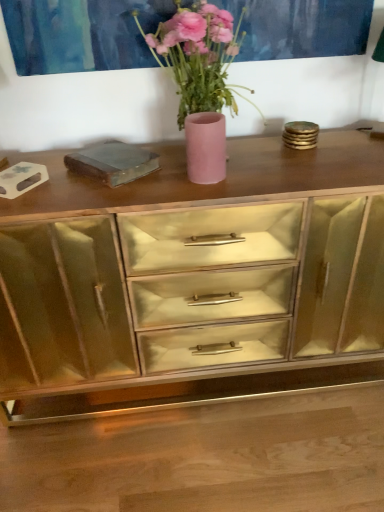
Question: Does pink matte vase at center appear on the left side of matte pink vase at center?

Choices:
 (A) yes
 (B) no

Answer: (B)

Question: Is pink matte vase at center facing away from matte pink vase at center?

Choices:
 (A) no
 (B) yes

Answer: (A)

Question: Is pink matte vase at center not near matte pink vase at center?

Choices:
 (A) yes
 (B) no

Answer: (B)

Question: Is pink matte vase at center touching matte pink vase at center?

Choices:
 (A) no
 (B) yes

Answer: (A)

Question: From a real-world perspective, is pink matte vase at center below matte pink vase at center?

Choices:
 (A) no
 (B) yes

Answer: (A)

Question: Is pink matte vase at center to the left or to the right of matte pink vase at center in the image?

Choices:
 (A) right
 (B) left

Answer: (A)

Question: Considering the positions of point (168, 32) and point (208, 135), is point (168, 32) closer or farther from the camera than point (208, 135)?

Choices:
 (A) farther
 (B) closer

Answer: (A)

Question: From the image's perspective, relative to matte pink vase at center, is pink matte vase at center above or below?

Choices:
 (A) above
 (B) below

Answer: (A)

Question: Is pink matte vase at center bigger or smaller than matte pink vase at center?

Choices:
 (A) big
 (B) small

Answer: (A)

Question: Based on their sizes in the image, would you say gold mirrored cabinet at center is bigger or smaller than pink matte vase at center?

Choices:
 (A) small
 (B) big

Answer: (B)

Question: Is gold mirrored cabinet at center inside or outside of pink matte vase at center?

Choices:
 (A) outside
 (B) inside

Answer: (A)

Question: Is gold mirrored cabinet at center wider or thinner than pink matte vase at center?

Choices:
 (A) thin
 (B) wide

Answer: (B)

Question: From the image's perspective, is gold mirrored cabinet at center located above or below pink matte vase at center?

Choices:
 (A) above
 (B) below

Answer: (B)

Question: Looking at their shapes, would you say matte pink vase at center is wider or thinner than pink matte vase at center?

Choices:
 (A) wide
 (B) thin

Answer: (B)

Question: Considering the positions of point (203, 128) and point (226, 53), is point (203, 128) closer or farther from the camera than point (226, 53)?

Choices:
 (A) farther
 (B) closer

Answer: (B)